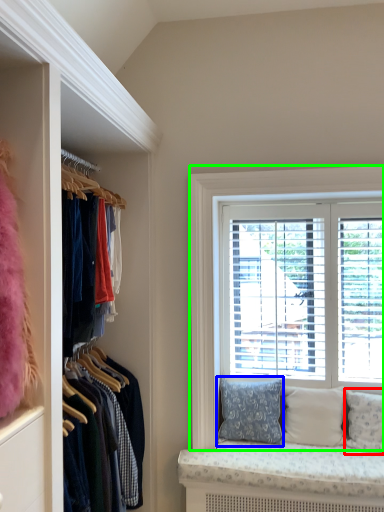
Question: Which is farther away from pillow (highlighted by a red box)? pillow (highlighted by a blue box) or window (highlighted by a green box)?

Choices:
 (A) pillow
 (B) window

Answer: (B)